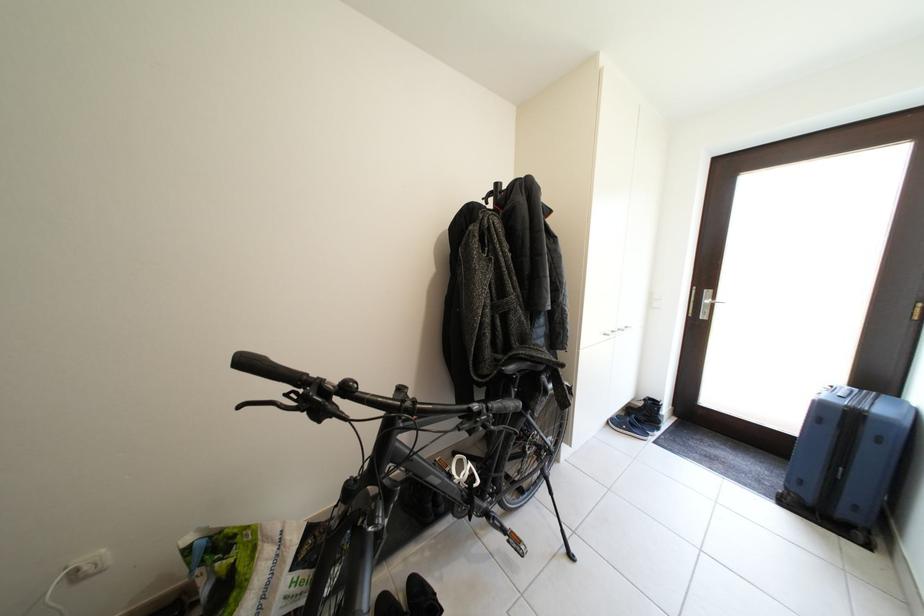
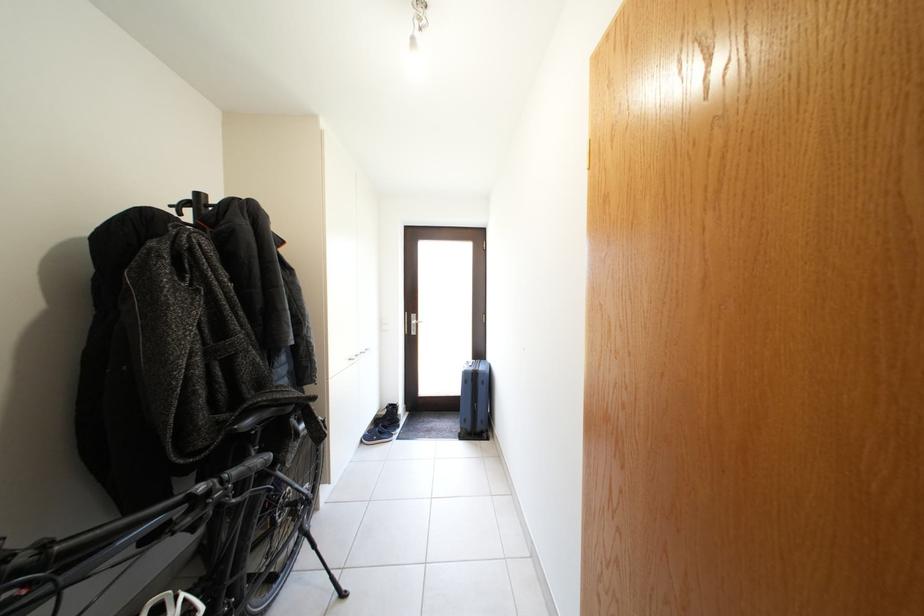
In the second image, find the point that corresponds to the point at 505,190 in the first image.

(205, 200)